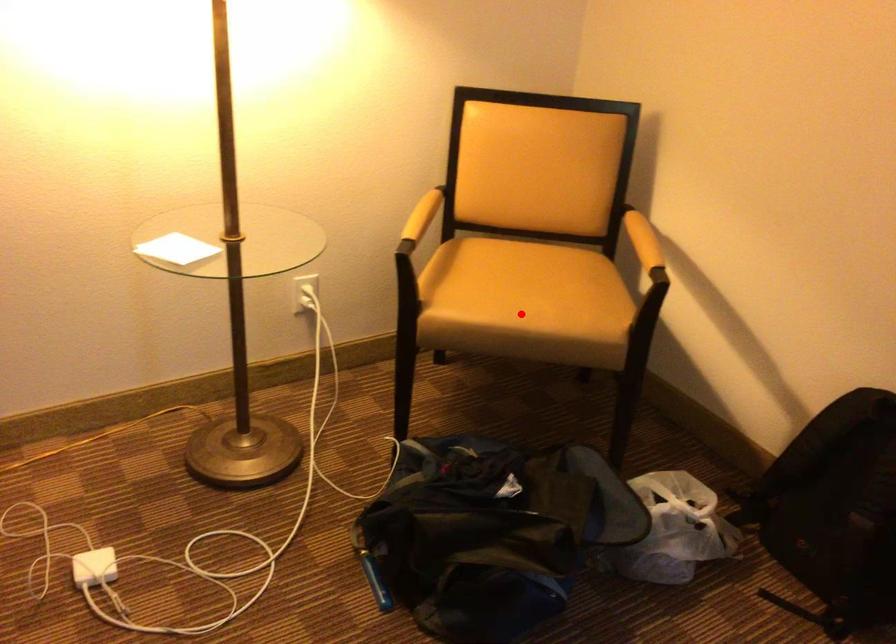
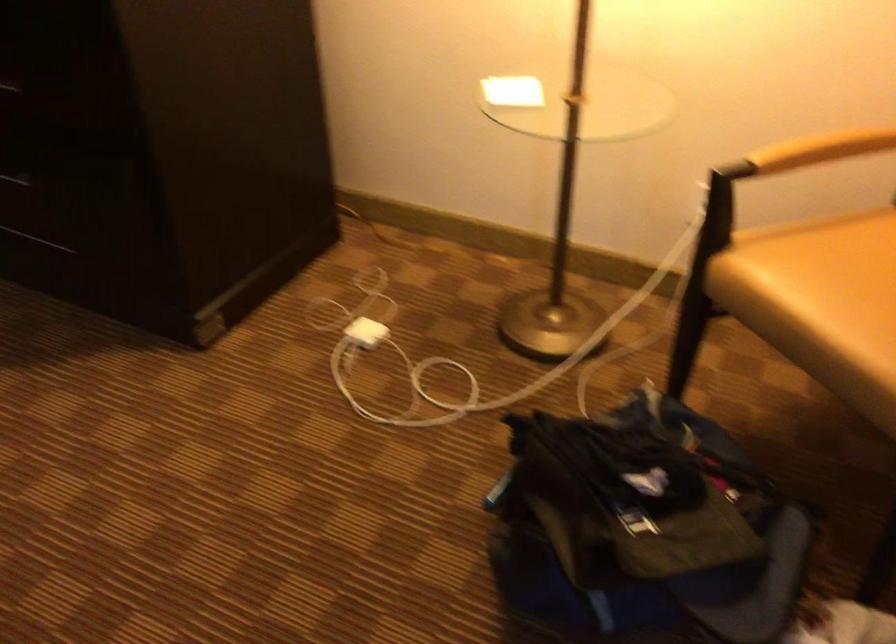
Question: I am providing you with two images of the same scene from different viewpoints. In image1, a red point is highlighted. Considering the same 3D point in image2, which of the following is correct?

Choices:
 (A) It is closer
 (B) It is farther

Answer: (A)